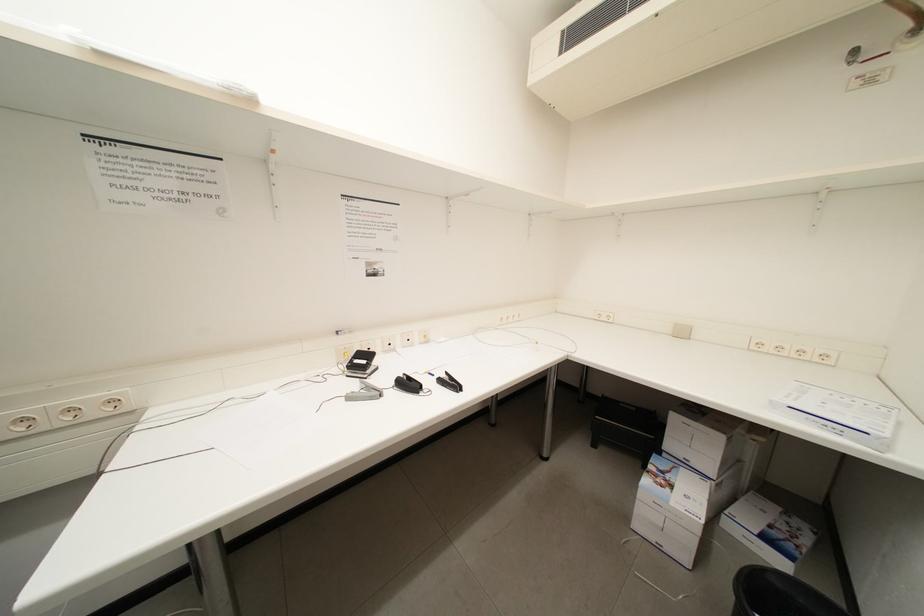
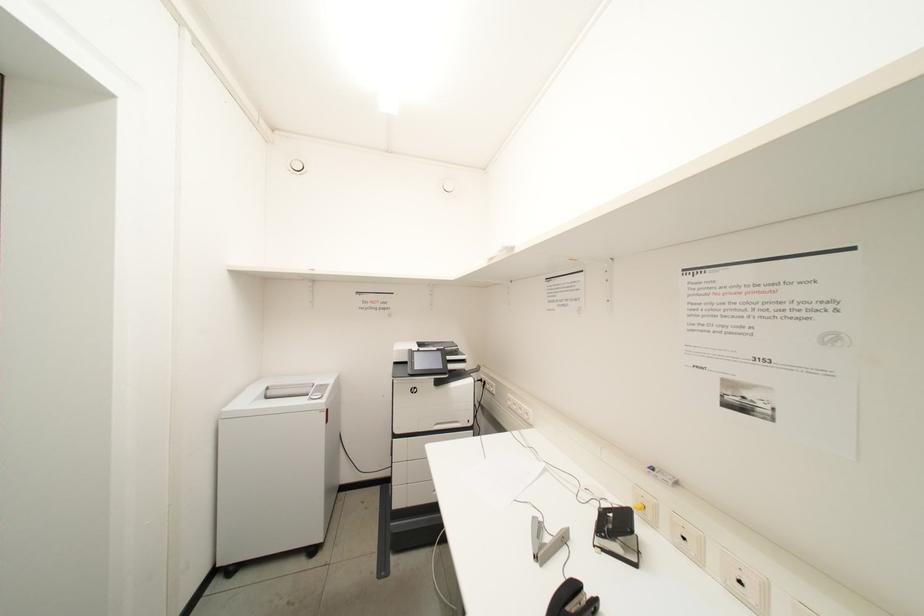
Question: The camera is either moving clockwise (left) or counter-clockwise (right) around the object. The first image is from the beginning of the video and the second image is from the end. Is the camera moving left or right when shooting the video?

Choices:
 (A) Left
 (B) Right

Answer: (B)